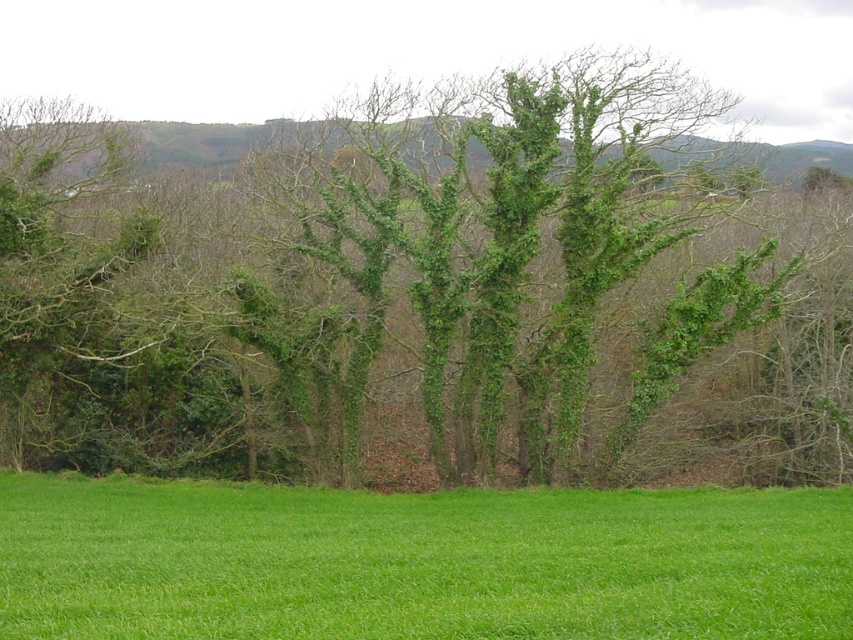
Question: Considering the relative positions of green leafy tree at center and green grass at center in the image provided, where is green leafy tree at center located with respect to green grass at center?

Choices:
 (A) left
 (B) right

Answer: (B)

Question: Is green grass at center positioned in front of green leafy hillside at upper center?

Choices:
 (A) no
 (B) yes

Answer: (B)

Question: Considering the real-world distances, which object is closest to the green leafy tree at center?

Choices:
 (A) green grass at center
 (B) green leafy hillside at upper center

Answer: (B)

Question: Which of these objects is positioned farthest from the green leafy hillside at upper center?

Choices:
 (A) green grass at center
 (B) green leafy tree at center

Answer: (A)

Question: Which point is closer to the camera?

Choices:
 (A) green leafy tree at center
 (B) green leafy hillside at upper center
 (C) green grass at center

Answer: (C)

Question: Can you confirm if green leafy tree at center is thinner than green leafy hillside at upper center?

Choices:
 (A) no
 (B) yes

Answer: (B)